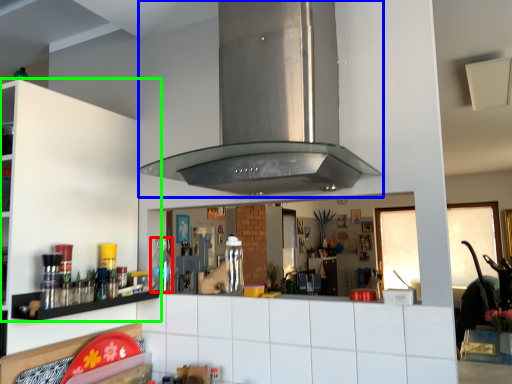
Question: Which is farther away from bottle (highlighted by a red box)? vent (highlighted by a blue box) or cabinetry (highlighted by a green box)?

Choices:
 (A) vent
 (B) cabinetry

Answer: (A)